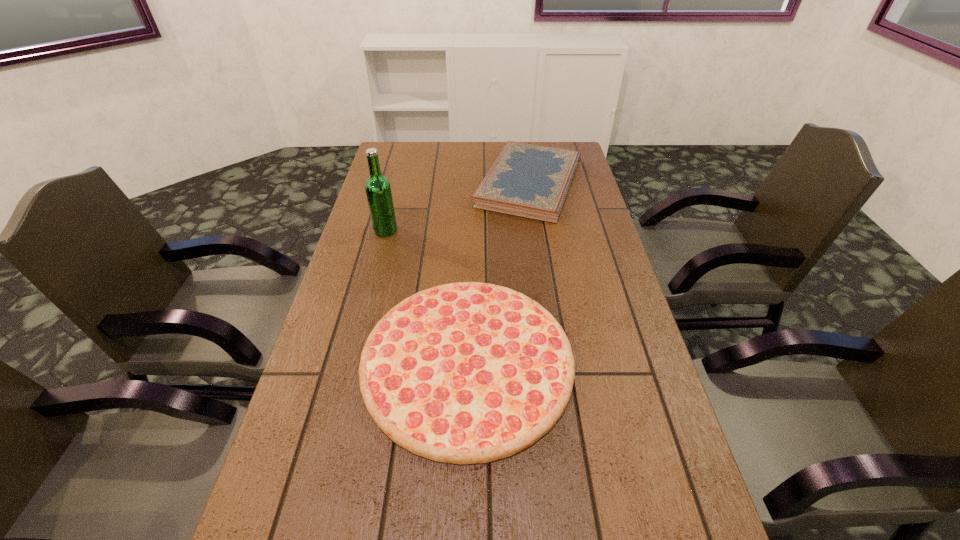
At what (x,y) coordinates should I click in order to perform the action: click on free space that satisfies the following two spatial constraints: 1. on the front side of the shortest object; 2. on the right side of the tallest object. Please return your answer as a coordinate pair (x, y). The width and height of the screenshot is (960, 540). Looking at the image, I should click on (351, 361).

At what (x,y) coordinates should I click in order to perform the action: click on free space that satisfies the following two spatial constraints: 1. on the front side of the nearest object; 2. on the right side of the tallest object. Please return your answer as a coordinate pair (x, y). This screenshot has width=960, height=540. Looking at the image, I should click on (351, 361).